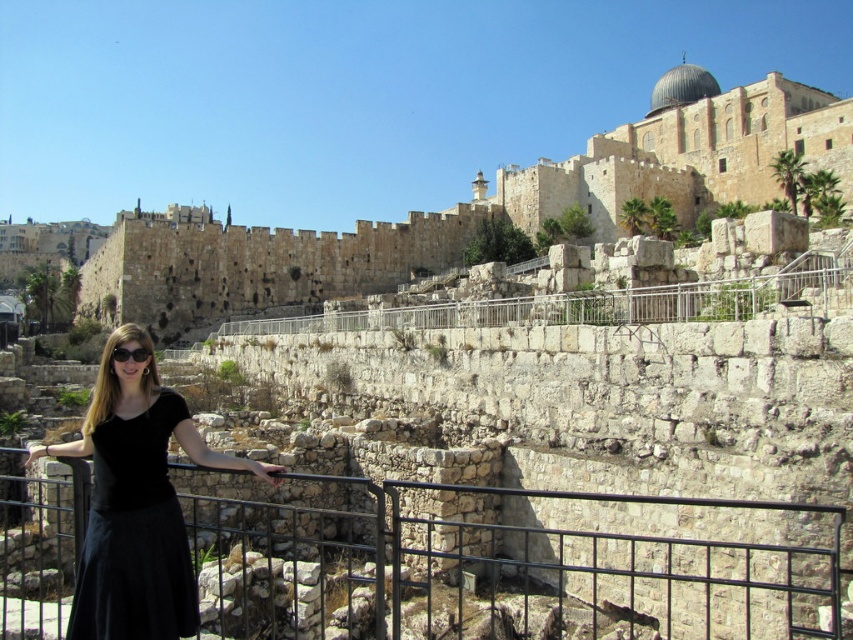
You are a tourist standing at the Western Wall and want to take a photo of both the point at coordinates point [496,209] and point [134,477]. Which point should you focus on first to ensure both are in the frame?

You should focus on point [134,477] first because it is closer to you than point [496,209], which is further away. This way, both points will be in the frame.

What is the location of the point with coordinates [135,534] in the image?

The point with coordinates [135,534] is located on the black velvet dress at center.

You are a photographer planning to take a photo of the Western Wall with the woman wearing the black velvet dress at center. If you want to include both the dress and the dome structure on the top of the wall in the same frame, would you need to adjust your camera angle upwards or downwards?

The black velvet dress at center is positioned at point (135, 534), which is relatively low in the frame. To include the dome structure on top of the Western Wall, you would need to adjust your camera angle upwards to capture both the dress and the dome in the same frame.